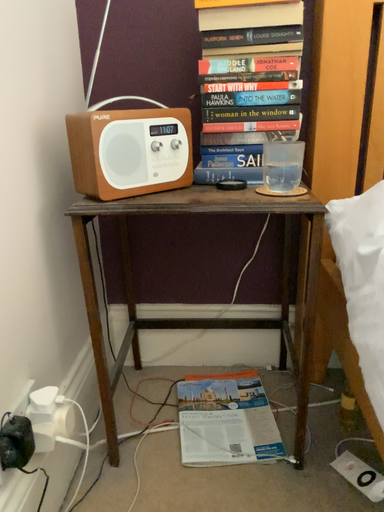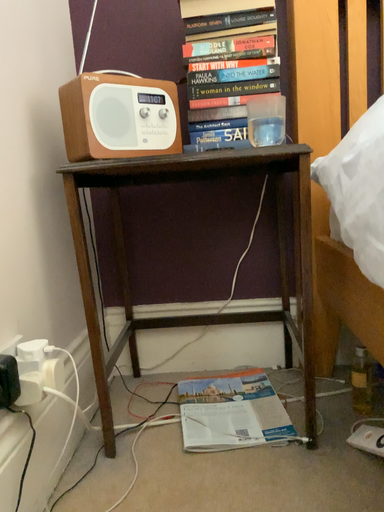
Question: Which way did the camera rotate in the video?

Choices:
 (A) rotated downward
 (B) rotated upward

Answer: (B)